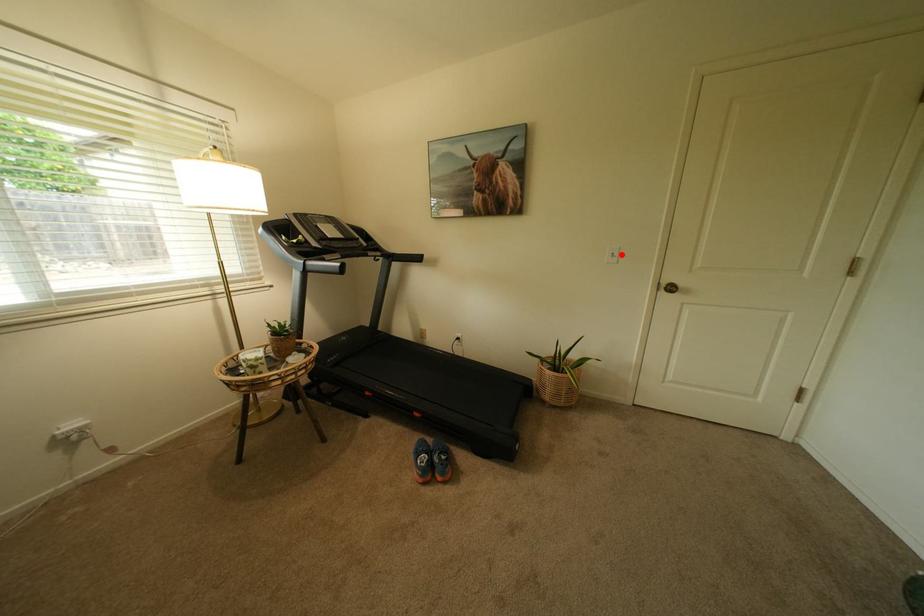
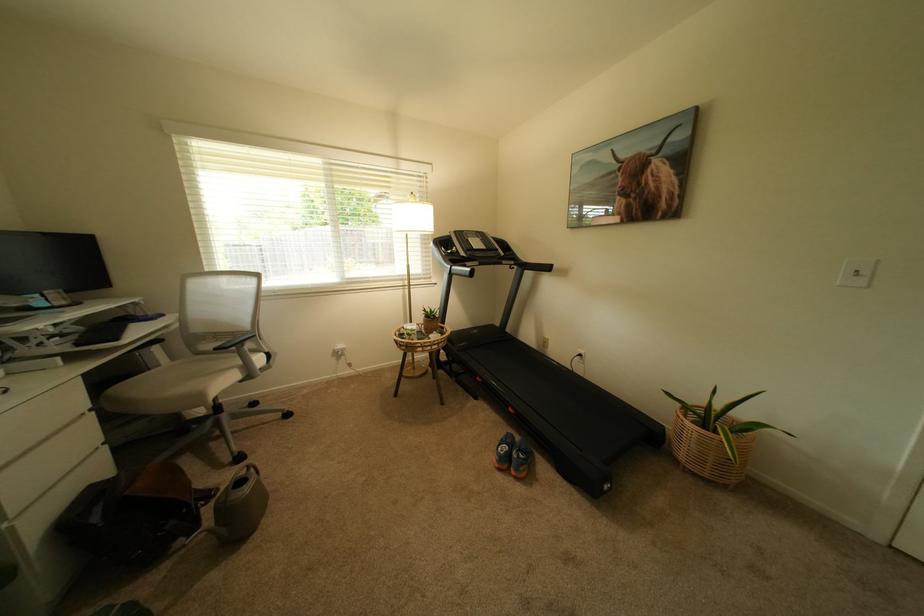
Locate, in the second image, the point that corresponds to the highlighted location in the first image.

(866, 272)